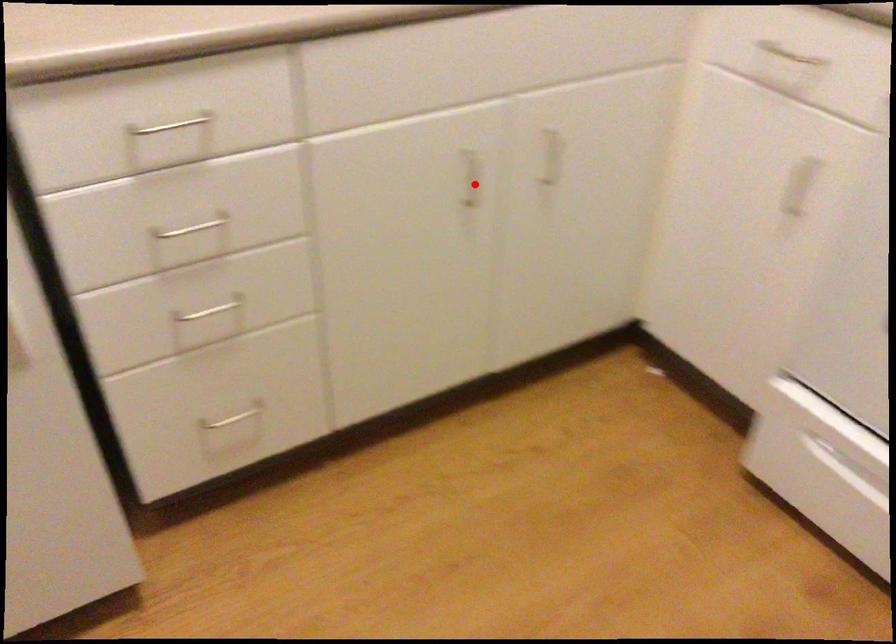
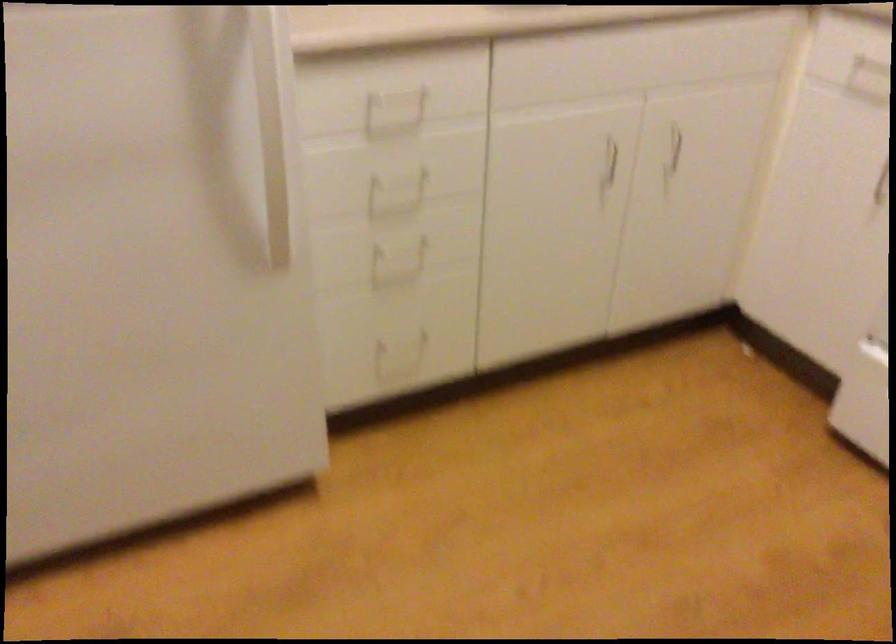
Locate, in the second image, the point that corresponds to the highlighted location in the first image.

(609, 161)